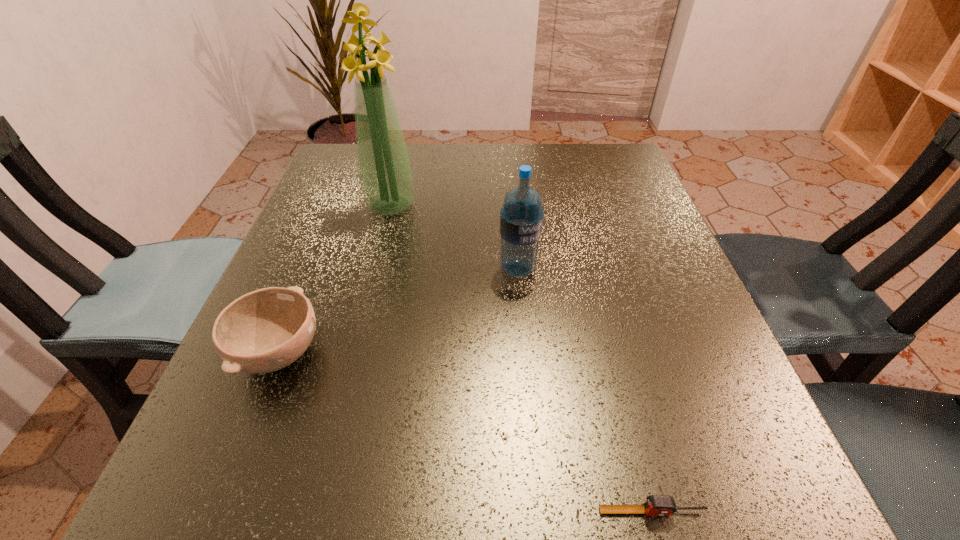
Image resolution: width=960 pixels, height=540 pixels. Identify the location of free point at the near edge. (454, 505).

In the image, there is a desktop. Find the location of `vacant space at the left edge`. vacant space at the left edge is located at coordinates (369, 238).

What are the coordinates of `blank space at the right edge of the desktop` in the screenshot? It's located at pos(625,350).

You are a GUI agent. You are given a task and a screenshot of the screen. Output one action in this format:
    pyautogui.click(x=<x>, y=<y>)
    Task: Click on the free space at the far right corner
    
    Given the screenshot: What is the action you would take?
    pyautogui.click(x=602, y=187)

This screenshot has width=960, height=540. What are the coordinates of `vacant space that's between the bowl and the farthest object` in the screenshot? It's located at (335, 279).

Where is `free spot between the nearest object and the farthest object`? This screenshot has width=960, height=540. free spot between the nearest object and the farthest object is located at coordinates (521, 359).

The width and height of the screenshot is (960, 540). Find the location of `free space between the shortest object and the bowl`. free space between the shortest object and the bowl is located at coordinates (x=466, y=432).

Where is `vacant point located between the third object from left to right and the rightmost object`? The image size is (960, 540). vacant point located between the third object from left to right and the rightmost object is located at coordinates (585, 390).

Where is `unoccupied area between the rightmost object and the bouquet`? This screenshot has height=540, width=960. unoccupied area between the rightmost object and the bouquet is located at coordinates (521, 359).

Where is `empty space between the tallest object and the shortest object`? The width and height of the screenshot is (960, 540). empty space between the tallest object and the shortest object is located at coordinates (521, 359).